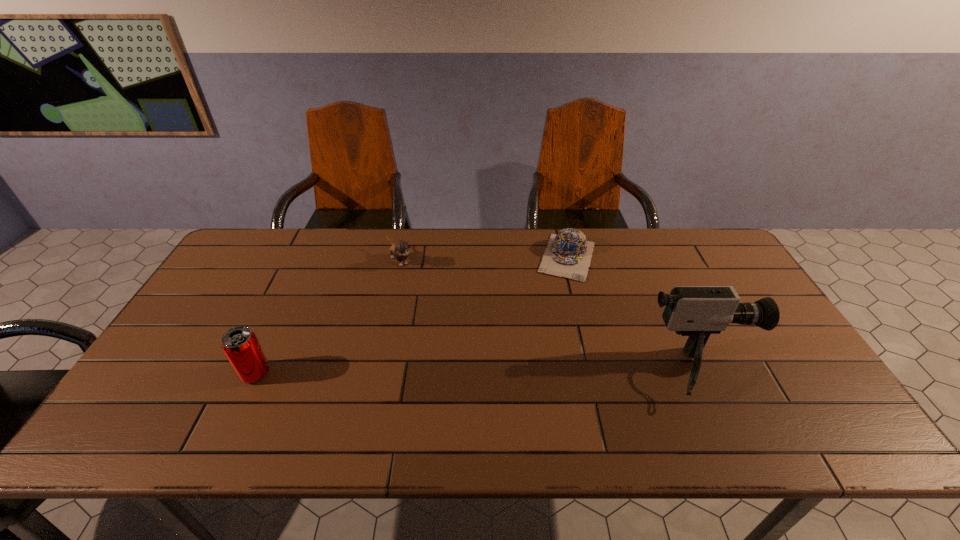
The height and width of the screenshot is (540, 960). What are the coordinates of `vacant space located on the front-facing side of the third tallest object` in the screenshot? It's located at (477, 347).

You are a GUI agent. You are given a task and a screenshot of the screen. Output one action in this format:
    pyautogui.click(x=<x>, y=<y>)
    Task: Click on the free space located 0.380m on the front-facing side of the third tallest object
    
    Given the screenshot: What is the action you would take?
    pyautogui.click(x=475, y=345)

Where is `free space located on the front-facing side of the third tallest object`? The width and height of the screenshot is (960, 540). free space located on the front-facing side of the third tallest object is located at coordinates (479, 349).

Identify the location of vacant position located 0.290m on the front, side, and top of the shortest object. (541, 350).

Where is `vacant region located 0.180m on the front, side, and top of the shortest object`? Image resolution: width=960 pixels, height=540 pixels. vacant region located 0.180m on the front, side, and top of the shortest object is located at coordinates coord(550,321).

The image size is (960, 540). In order to click on vacant space situated 0.390m on the front, side, and top of the shortest object in this screenshot , I will do [533, 380].

The width and height of the screenshot is (960, 540). What are the coordinates of `kitten positioned at the far edge` in the screenshot? It's located at (399, 251).

The width and height of the screenshot is (960, 540). I want to click on cap present at the far edge, so click(568, 255).

Image resolution: width=960 pixels, height=540 pixels. Identify the location of soda can that is at the near edge. (240, 345).

This screenshot has width=960, height=540. Identify the location of camcorder at the near edge. (696, 311).